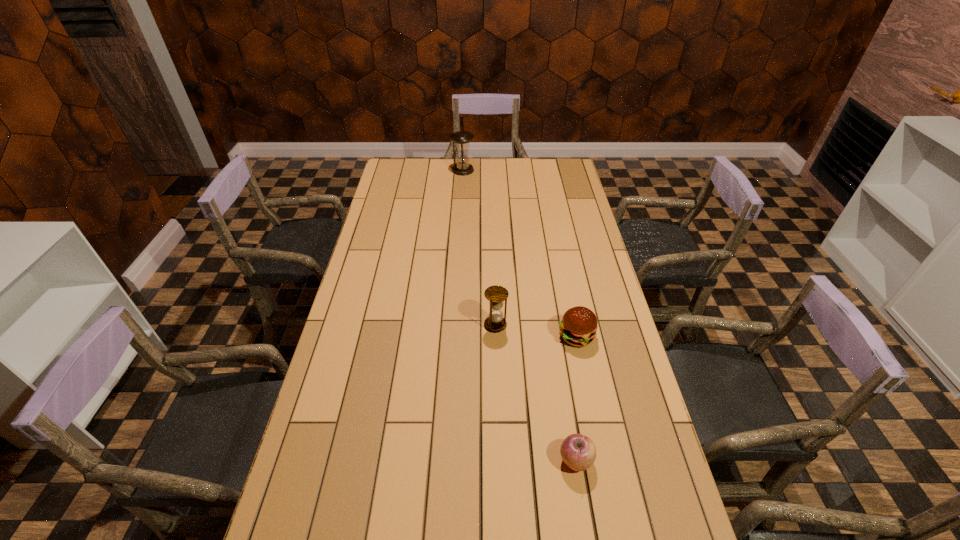
I want to click on vacant space in between the nearest object and the right hourglass, so click(x=536, y=393).

Find the location of a particular element. Image resolution: width=960 pixels, height=540 pixels. blank region between the nearest object and the left hourglass is located at coordinates pos(519,315).

Locate an element on the screen. blank region between the leftmost object and the hamburger is located at coordinates (519, 253).

The height and width of the screenshot is (540, 960). What are the coordinates of `free space between the nearest object and the farther hourglass` in the screenshot? It's located at (519, 315).

Find the location of `free spot between the hamburger and the farther hourglass`. free spot between the hamburger and the farther hourglass is located at coordinates 519,253.

Where is `vacant space that's between the right hourglass and the hamburger`? The height and width of the screenshot is (540, 960). vacant space that's between the right hourglass and the hamburger is located at coordinates (536, 330).

Choose which object is the second nearest neighbor to the third shortest object. Please provide its 2D coordinates. Your answer should be formatted as a tuple, i.e. [(x, y)], where the tuple contains the x and y coordinates of a point satisfying the conditions above.

[(578, 451)]

Where is `object that is the second closest to the leftmost object`? The image size is (960, 540). object that is the second closest to the leftmost object is located at coordinates (578, 327).

This screenshot has width=960, height=540. Find the location of `vacant region that satisfies the following two spatial constraints: 1. on the front side of the hamburger; 2. on the right side of the second tallest object`. vacant region that satisfies the following two spatial constraints: 1. on the front side of the hamburger; 2. on the right side of the second tallest object is located at coordinates (495, 336).

Locate an element on the screen. The width and height of the screenshot is (960, 540). vacant position in the image that satisfies the following two spatial constraints: 1. on the front side of the apple; 2. on the right side of the nearer hourglass is located at coordinates (500, 461).